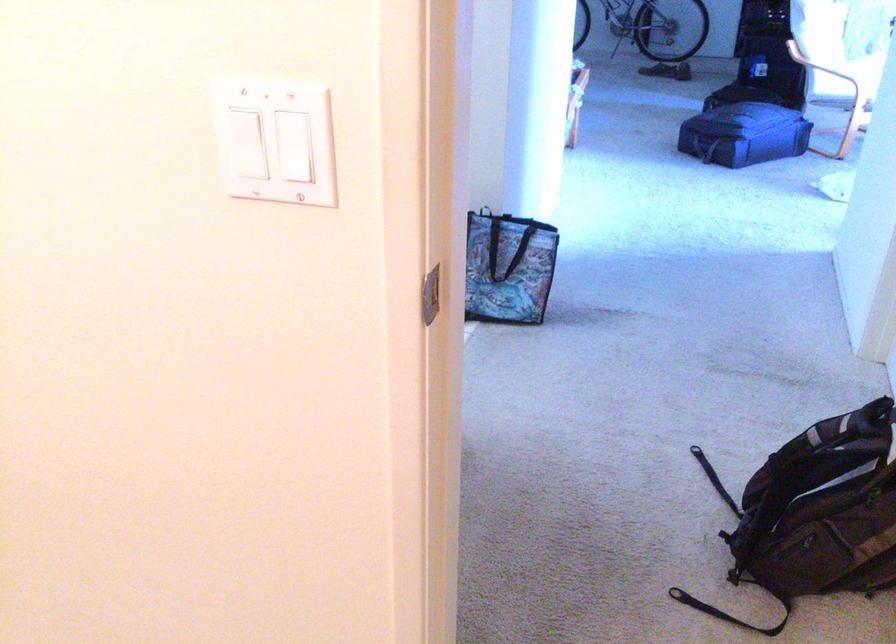
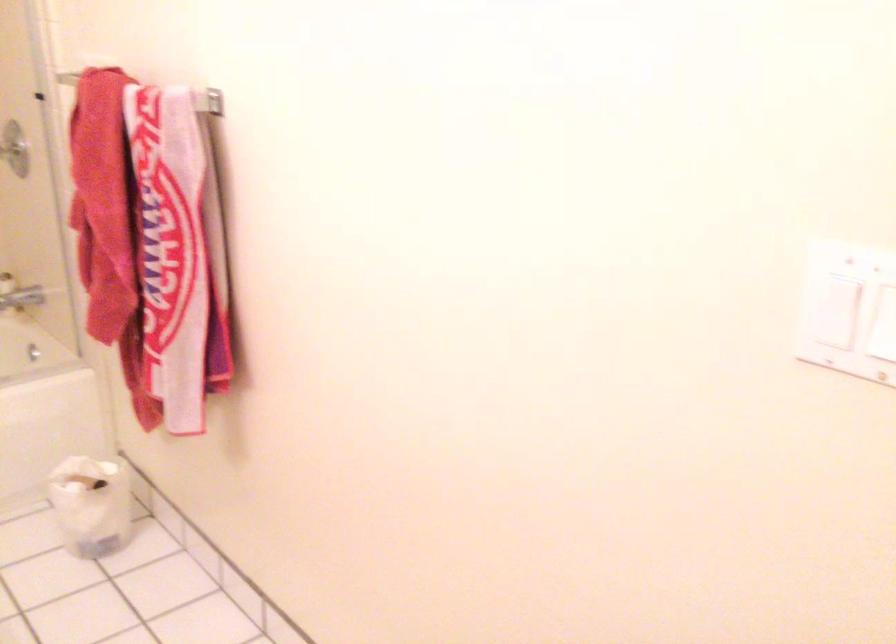
Where in the second image is the point corresponding to the point at 279,149 from the first image?

(883, 319)